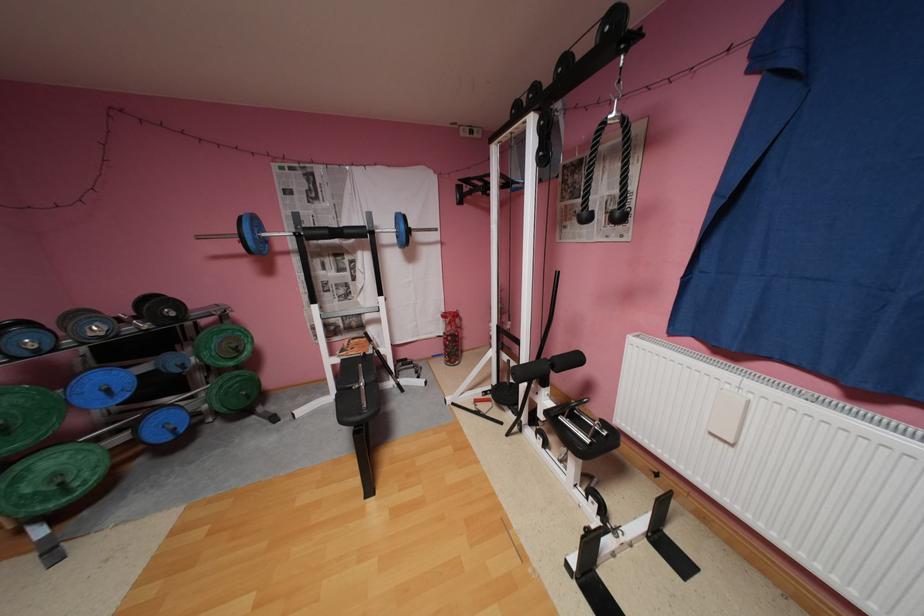
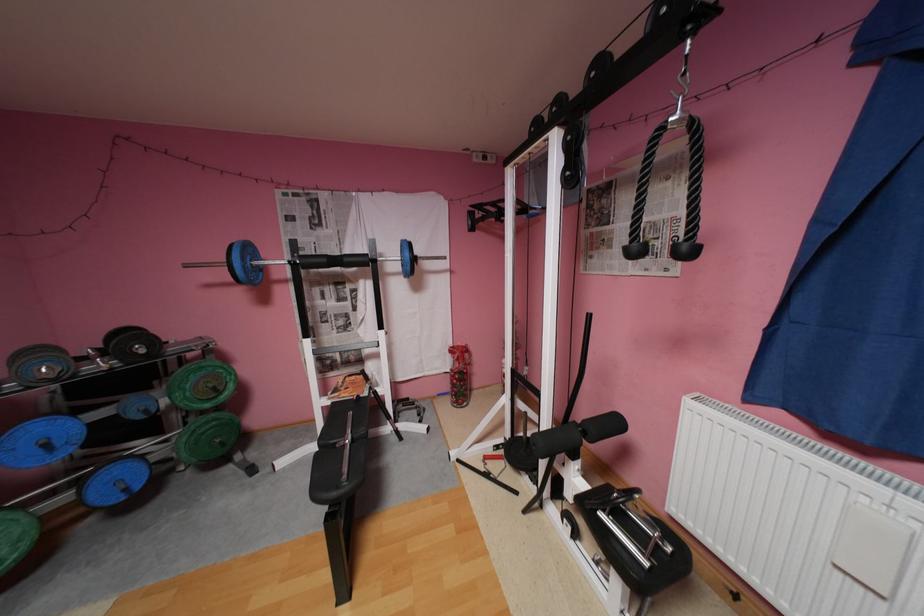
The point at [181,314] is marked in the first image. Where is the corresponding point in the second image?

(152, 351)